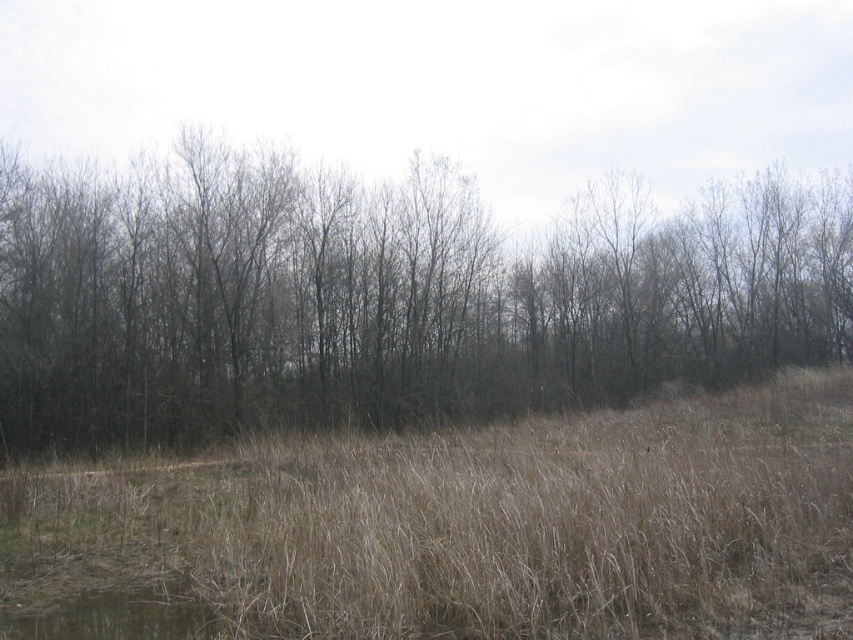
Question: Which point is farther to the camera?

Choices:
 (A) (384, 328)
 (B) (27, 492)

Answer: (A)

Question: Does brown/dry grass at center have a larger size compared to dry grass at center?

Choices:
 (A) no
 (B) yes

Answer: (B)

Question: Which point is farther to the camera?

Choices:
 (A) (589, 436)
 (B) (321, 182)

Answer: (B)

Question: Is brown/dry grass at center to the left of dry grass at center from the viewer's perspective?

Choices:
 (A) no
 (B) yes

Answer: (A)

Question: From the image, what is the correct spatial relationship of brown/dry grass at center in relation to dry grass at center?

Choices:
 (A) right
 (B) left

Answer: (A)

Question: Among these points, which one is nearest to the camera?

Choices:
 (A) (482, 588)
 (B) (372, 380)

Answer: (A)